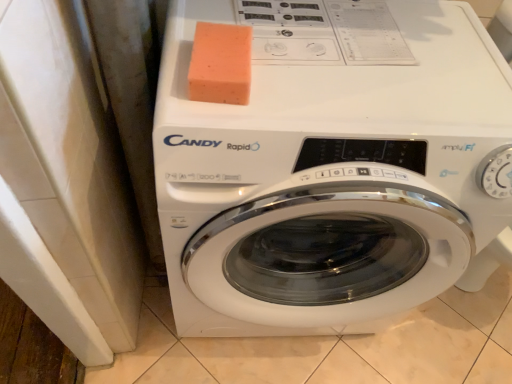
Locate an element on the screen. The image size is (512, 384). vacant area on the back side of orange sponge at upper center is located at coordinates (255, 18).